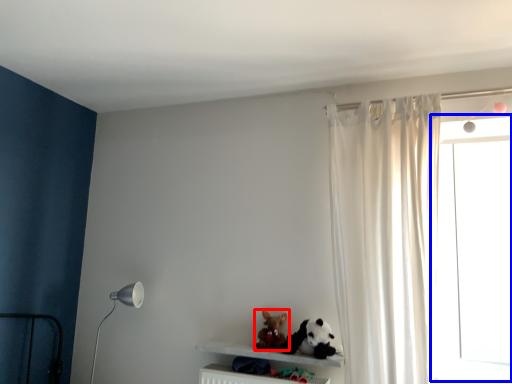
Question: Which object appears farthest to the camera in this image, toy (highlighted by a red box) or window frame (highlighted by a blue box)?

Choices:
 (A) toy
 (B) window frame

Answer: (A)